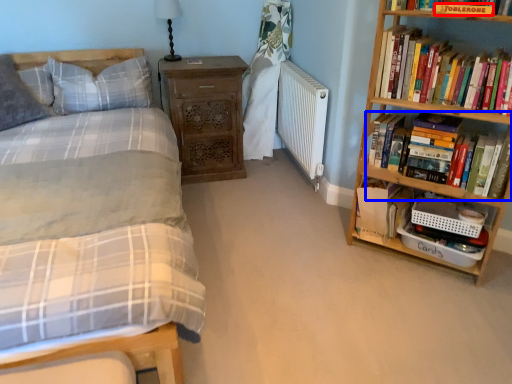
Question: Which object appears closest to the camera in this image, paperback book (highlighted by a red box) or book (highlighted by a blue box)?

Choices:
 (A) paperback book
 (B) book

Answer: (A)